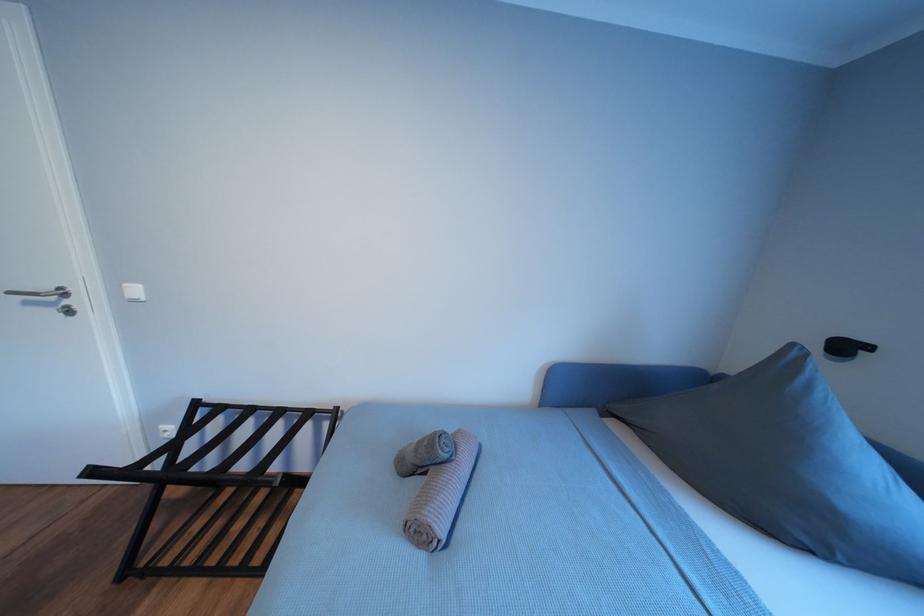
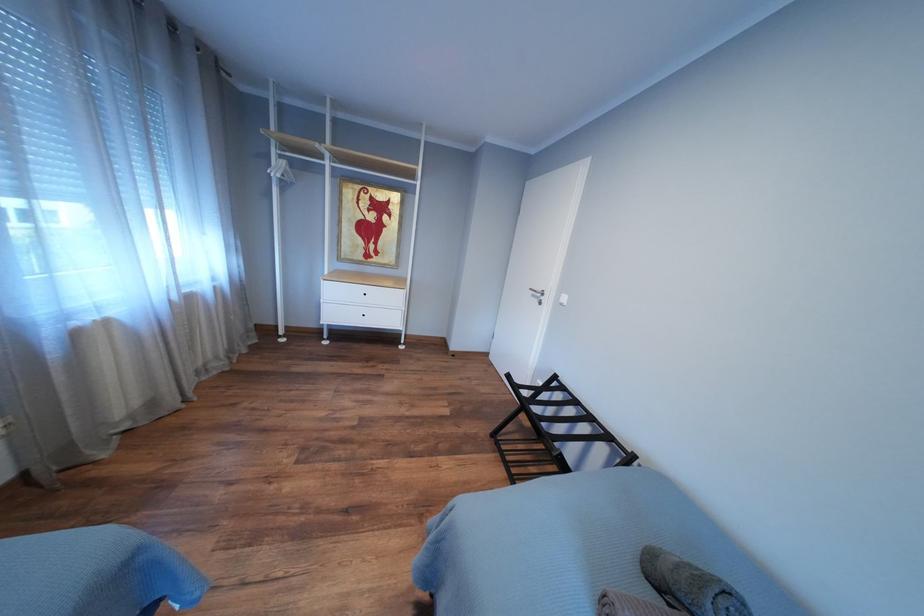
Question: The camera is either moving clockwise (left) or counter-clockwise (right) around the object. The first image is from the beginning of the video and the second image is from the end. Is the camera moving left or right when shooting the video?

Choices:
 (A) Left
 (B) Right

Answer: (B)